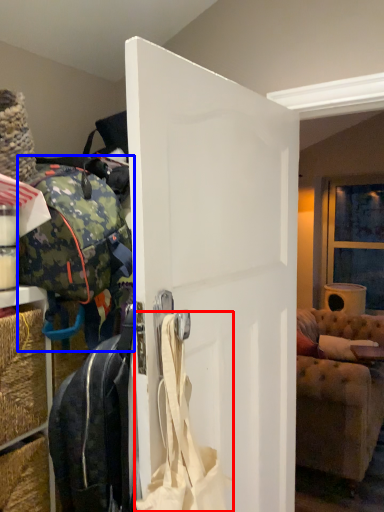
Question: Among these objects, which one is nearest to the camera, shoulder bag (highlighted by a red box) or luggage and bags (highlighted by a blue box)?

Choices:
 (A) shoulder bag
 (B) luggage and bags

Answer: (A)